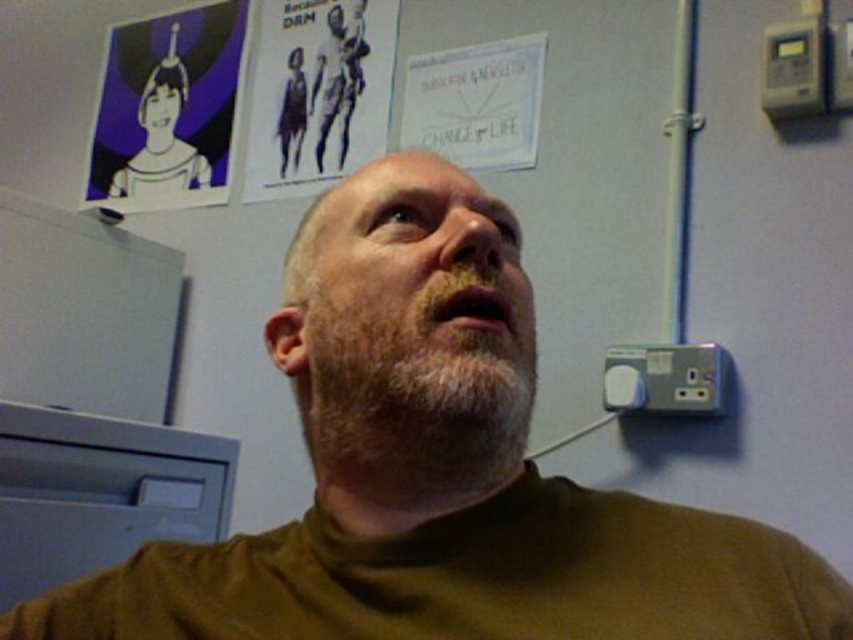
Looking at this image, can you confirm if gray matte beard at center is thinner than matte paper poster at upper center?

Indeed, gray matte beard at center has a lesser width compared to matte paper poster at upper center.

Between gray matte beard at center and matte paper poster at upper center, which one is positioned lower?

gray matte beard at center is below.

Is point (450, 428) more distant than point (321, 120)?

No, it is in front of (321, 120).

Locate an element on the screen. The width and height of the screenshot is (853, 640). gray matte beard at center is located at coordinates (419, 385).

Between point (376, 16) and point (318, 86), which one is positioned in front?

Point (376, 16) is in front.

In the scene shown: Can you confirm if matte paper poster at upper center is positioned above smooth black figure at upper center?

Incorrect, matte paper poster at upper center is not positioned above smooth black figure at upper center.

At what (x,y) coordinates should I click in order to perform the action: click on matte paper poster at upper center. Please return your answer as a coordinate pair (x, y). This screenshot has width=853, height=640. Looking at the image, I should click on (318, 92).

Can you confirm if beige facial hair at center is smaller than gray matte beard at center?

No, beige facial hair at center is not smaller than gray matte beard at center.

Locate an element on the screen. beige facial hair at center is located at coordinates (416, 300).